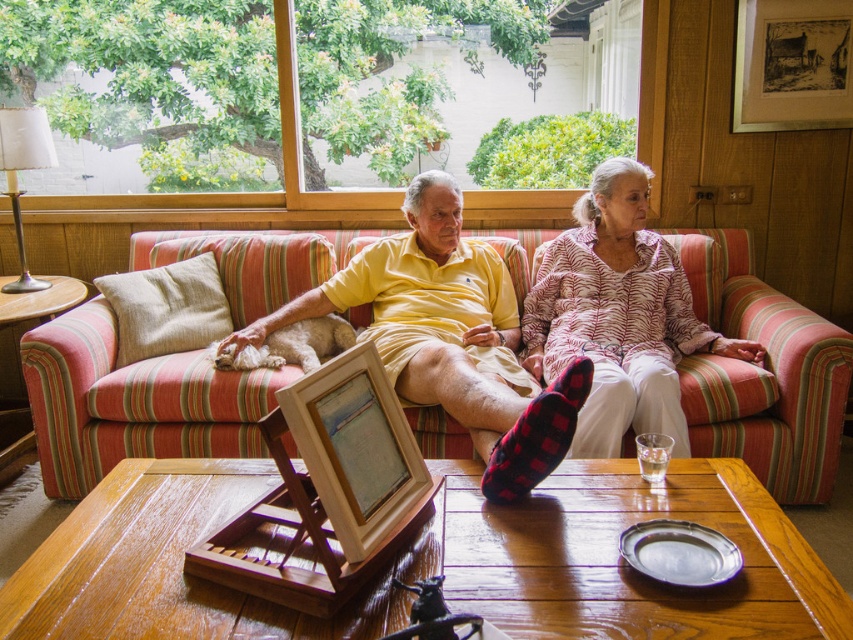
Is wooden picture frame at center closer to camera compared to red plaid sock at center?

That is True.

Between wooden picture frame at center and red plaid sock at center, which one has more height?

wooden picture frame at center is taller.

Find the location of a particular element. This screenshot has height=640, width=853. wooden picture frame at center is located at coordinates pyautogui.click(x=355, y=445).

Between point (666, 308) and point (395, 458), which one is positioned in front?

Positioned in front is point (395, 458).

Is printed cotton pajama top at center to the right of wooden picture frame at center from the viewer's perspective?

Yes, printed cotton pajama top at center is to the right of wooden picture frame at center.

This screenshot has height=640, width=853. I want to click on printed cotton pajama top at center, so click(x=618, y=316).

Is wooden table at center behind printed cotton pajama top at center?

No, wooden table at center is in front of printed cotton pajama top at center.

Between wooden table at center and printed cotton pajama top at center, which one has more height?

printed cotton pajama top at center is taller.

Identify the location of wooden table at center. The height and width of the screenshot is (640, 853). (160, 564).

Find the location of a particular element. Image resolution: width=853 pixels, height=640 pixels. wooden table at center is located at coordinates (160, 564).